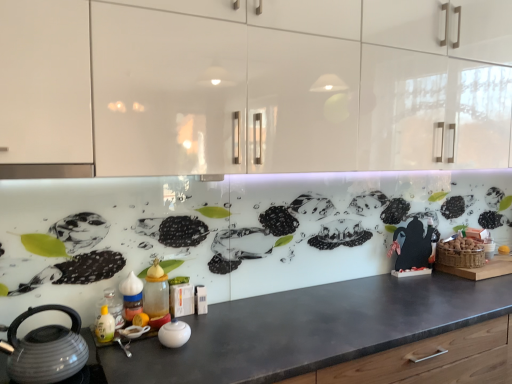
I want to click on vacant space positioned to the left of white glossy bowl at center, so click(130, 343).